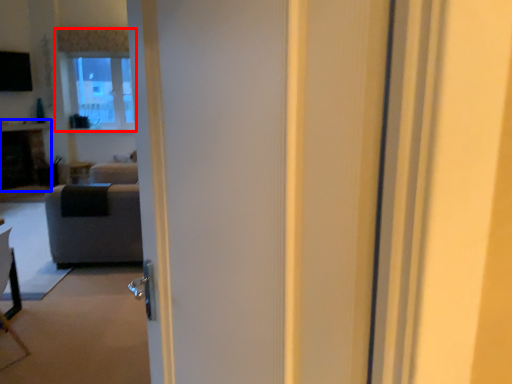
Question: Which point is further to the camera, window (highlighted by a red box) or fireplace (highlighted by a blue box)?

Choices:
 (A) window
 (B) fireplace

Answer: (A)